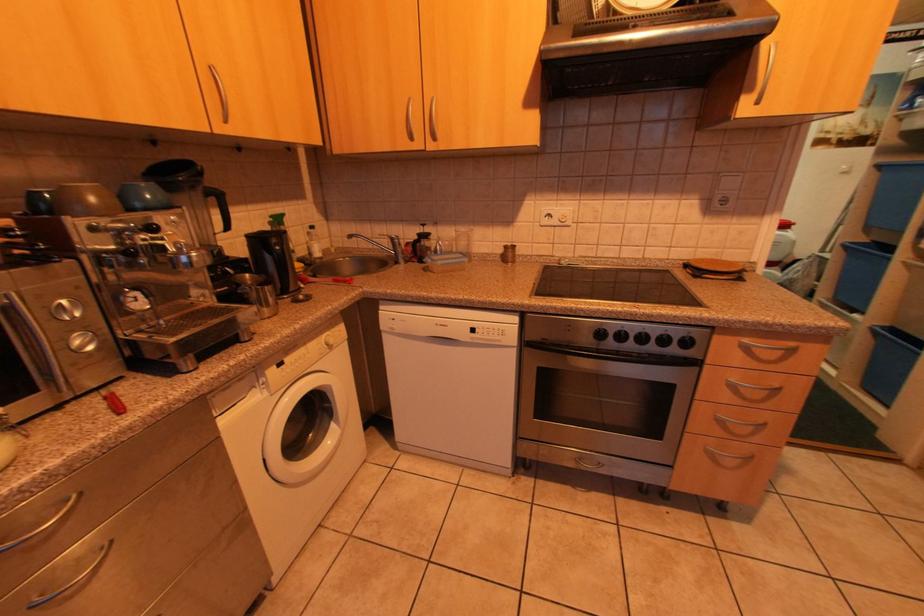
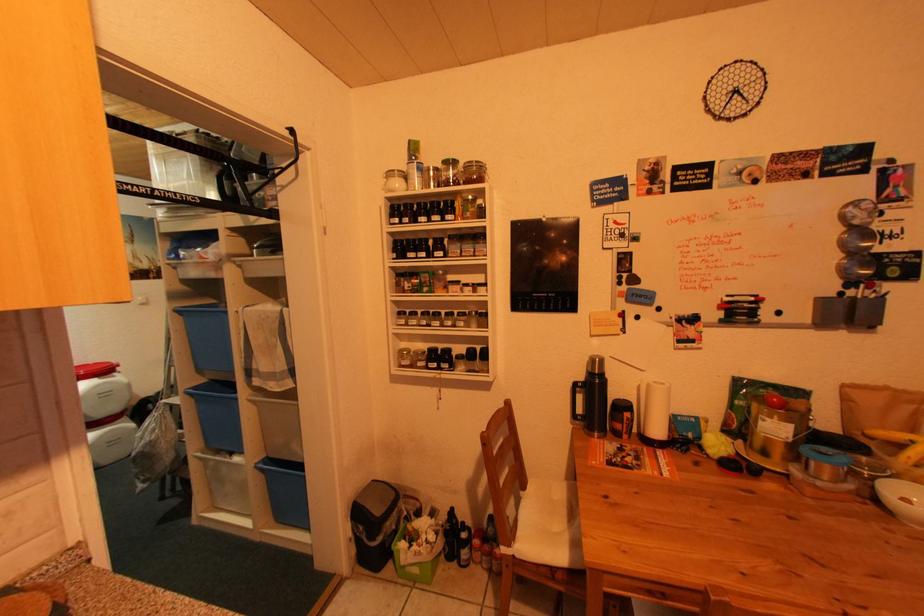
Question: How did the camera likely rotate?

Choices:
 (A) Left
 (B) Right
 (C) Up
 (D) Down

Answer: (B)